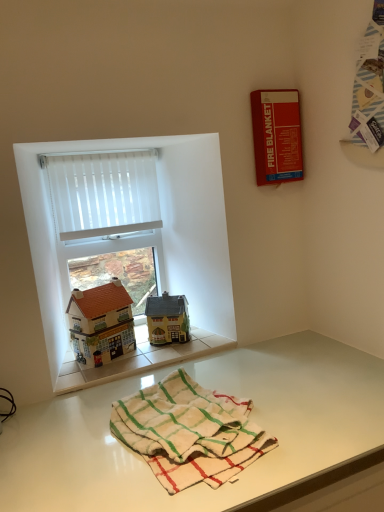
Identify the location of free space in front of matte yellow house at center, which ranks as the first toy in right-to-left order. (158, 356).